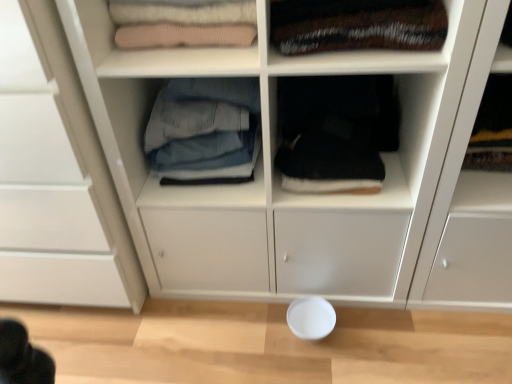
Question: Would you say knit fabric sweater at upper left, placed as the 1th shelf when sorted from top to bottom, is outside velvet-like brown blanket at upper right, the 2th clothing viewed from the left?

Choices:
 (A) yes
 (B) no

Answer: (A)

Question: Is knit fabric sweater at upper left, which appears as the 1th shelf when viewed from the left, closer to camera compared to velvet-like brown blanket at upper right, the first clothing in the right-to-left sequence?

Choices:
 (A) no
 (B) yes

Answer: (A)

Question: Does knit fabric sweater at upper left, the second shelf from the bottom, have a larger size compared to velvet-like brown blanket at upper right, the first clothing in the right-to-left sequence?

Choices:
 (A) no
 (B) yes

Answer: (A)

Question: Considering the relative positions of knit fabric sweater at upper left, which appears as the 1th shelf when viewed from the left, and velvet-like brown blanket at upper right, the 2th clothing viewed from the left, in the image provided, is knit fabric sweater at upper left, which appears as the 1th shelf when viewed from the left, to the right of velvet-like brown blanket at upper right, the 2th clothing viewed from the left, from the viewer's perspective?

Choices:
 (A) yes
 (B) no

Answer: (B)

Question: Can you confirm if knit fabric sweater at upper left, the second shelf from the bottom, is wider than velvet-like brown blanket at upper right, the first clothing in the right-to-left sequence?

Choices:
 (A) yes
 (B) no

Answer: (B)

Question: In terms of height, does black fabric at center, which is the 1th shelf from right to left, look taller or shorter compared to denim jeans at center, the second clothing positioned from the right?

Choices:
 (A) tall
 (B) short

Answer: (B)

Question: Considering the positions of point (428, 112) and point (242, 117), is point (428, 112) closer or farther from the camera than point (242, 117)?

Choices:
 (A) farther
 (B) closer

Answer: (B)

Question: Considering their positions, is black fabric at center, arranged as the 2th shelf when viewed from the top, located in front of or behind denim jeans at center, acting as the 1th clothing starting from the left?

Choices:
 (A) behind
 (B) front

Answer: (A)

Question: Is black fabric at center, which is the 1th shelf from right to left, spatially inside denim jeans at center, the second clothing positioned from the right, or outside of it?

Choices:
 (A) inside
 (B) outside

Answer: (B)

Question: From the image's perspective, is knit fabric sweater at upper left, the second shelf from the bottom, above or below black fabric at center, which is counted as the second shelf, starting from the left?

Choices:
 (A) above
 (B) below

Answer: (A)

Question: Considering the positions of knit fabric sweater at upper left, placed as the 1th shelf when sorted from top to bottom, and black fabric at center, which is counted as the second shelf, starting from the left, in the image, is knit fabric sweater at upper left, placed as the 1th shelf when sorted from top to bottom, taller or shorter than black fabric at center, which is counted as the second shelf, starting from the left,?

Choices:
 (A) short
 (B) tall

Answer: (A)

Question: From a real-world perspective, is knit fabric sweater at upper left, placed as the 1th shelf when sorted from top to bottom, positioned above or below black fabric at center, arranged as the 2th shelf when viewed from the top?

Choices:
 (A) above
 (B) below

Answer: (A)

Question: Considering the relative positions of knit fabric sweater at upper left, placed as the 1th shelf when sorted from top to bottom, and black fabric at center, which is counted as the second shelf, starting from the left, in the image provided, is knit fabric sweater at upper left, placed as the 1th shelf when sorted from top to bottom, to the left or to the right of black fabric at center, which is counted as the second shelf, starting from the left,?

Choices:
 (A) left
 (B) right

Answer: (A)

Question: In terms of size, does velvet-like brown blanket at upper right, the first clothing in the right-to-left sequence, appear bigger or smaller than white matte bowl at lower center?

Choices:
 (A) big
 (B) small

Answer: (A)

Question: Considering the positions of point (372, 13) and point (305, 324), is point (372, 13) closer or farther from the camera than point (305, 324)?

Choices:
 (A) farther
 (B) closer

Answer: (B)